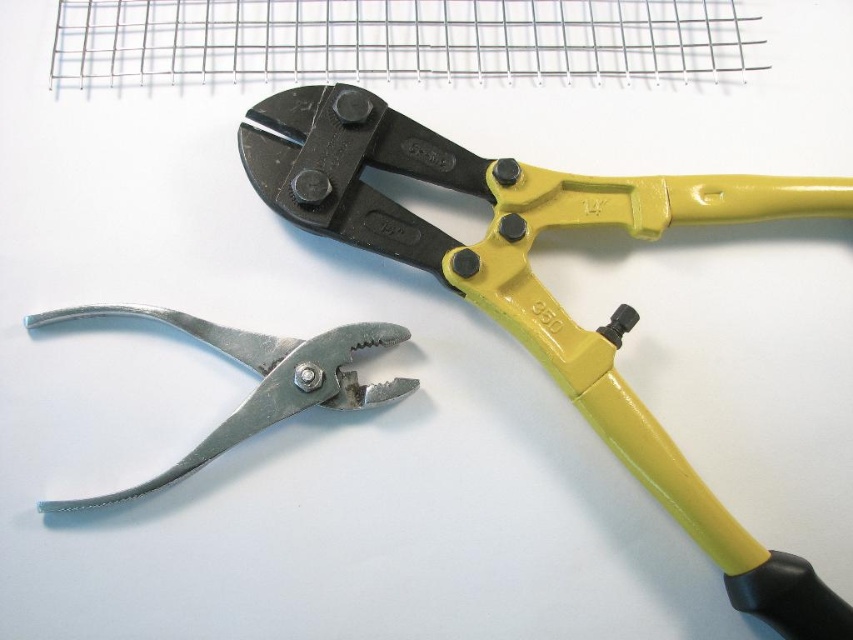
You are taking a photo of two points on a white surface. The first point is labeled as point (717, 216) and the second is point (289, 360). When you look through the camera viewfinder, which point appears closer to the top edge of the frame?

Point (717, 216) appears closer to the top edge of the frame because it has a lower y coordinate value than point (289, 360).